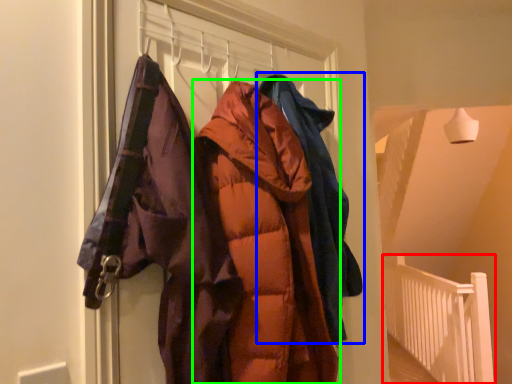
Question: Considering the real-world distances, which object is farthest from balustrade (highlighted by a red box)? jacket (highlighted by a blue box) or jacket (highlighted by a green box)?

Choices:
 (A) jacket
 (B) jacket

Answer: (B)